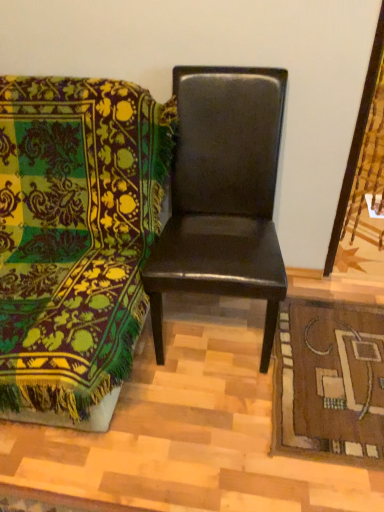
Locate an element on the screen. The width and height of the screenshot is (384, 512). free spot above brown woven mat at lower right (from a real-world perspective) is located at coordinates (331, 366).